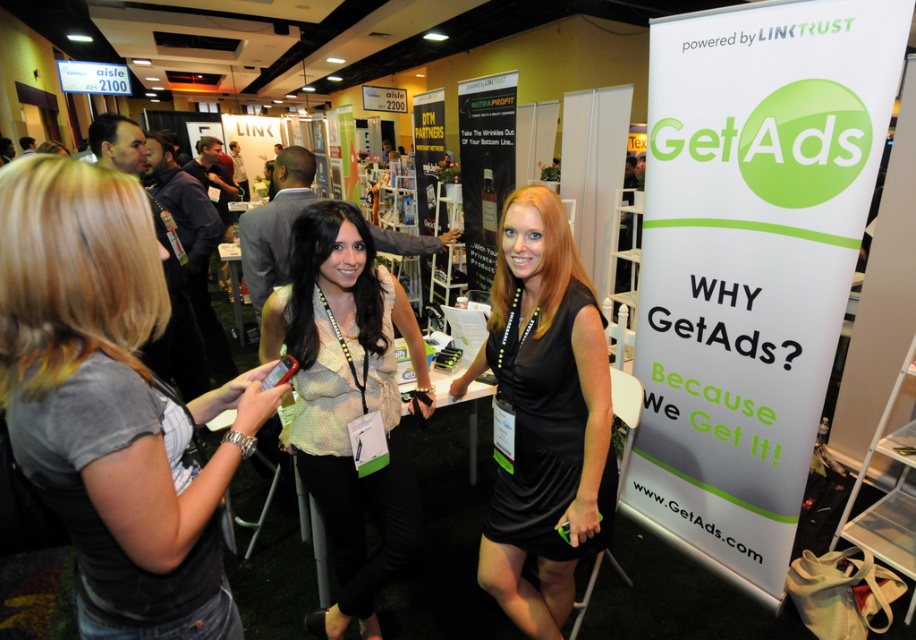
You are an event planner trying to set up a photo shoot for a promotional video. You have to position a model wearing the light beige sheer blouse at center in front of the white paper banner at right. Considering their sizes, will the banner be wide enough to frame the model properly?

The white paper banner at right is wider than the light beige sheer blouse at center, so it should be wide enough to frame the model properly.

What are the coordinates of the gray fabric shirt at left?

The gray fabric shirt at left is located at coordinates point (112, 403).

You are a photographer at the trade show. You want to take a photo that includes both the white paper banner at right and the black satin dress at center. Which object should be placed closer to the camera to ensure both are in focus?

The white paper banner at right is further to the viewer than the black satin dress at center, so to ensure both are in focus, the banner should be closer to the camera since it is already nearer to the photographer.